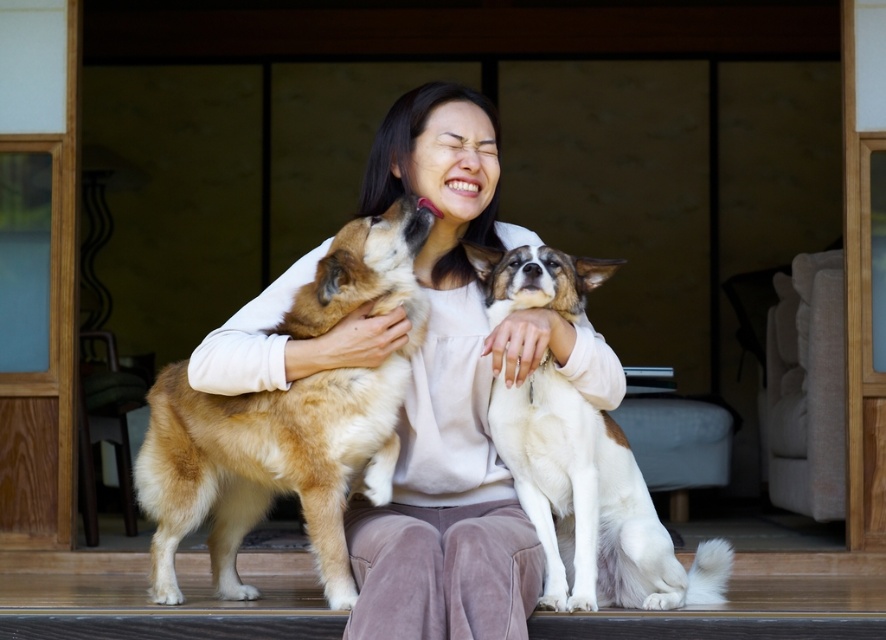
Question: Estimate the real-world distances between objects in this image. Which object is farther from the smooth beige sweater at center?

Choices:
 (A) white fur dog at center
 (B) golden fur dog at center

Answer: (A)

Question: Can you confirm if smooth beige sweater at center is smaller than golden fur dog at center?

Choices:
 (A) no
 (B) yes

Answer: (A)

Question: Which point is farther to the camera?

Choices:
 (A) (488, 276)
 (B) (364, 550)
 (C) (327, 289)

Answer: (A)

Question: Where is golden fur dog at center located in relation to white fur dog at center in the image?

Choices:
 (A) right
 (B) left

Answer: (B)

Question: Is smooth beige sweater at center in front of white fur dog at center?

Choices:
 (A) no
 (B) yes

Answer: (B)

Question: Which point is closer to the camera taking this photo?

Choices:
 (A) (612, 488)
 (B) (271, 288)

Answer: (B)